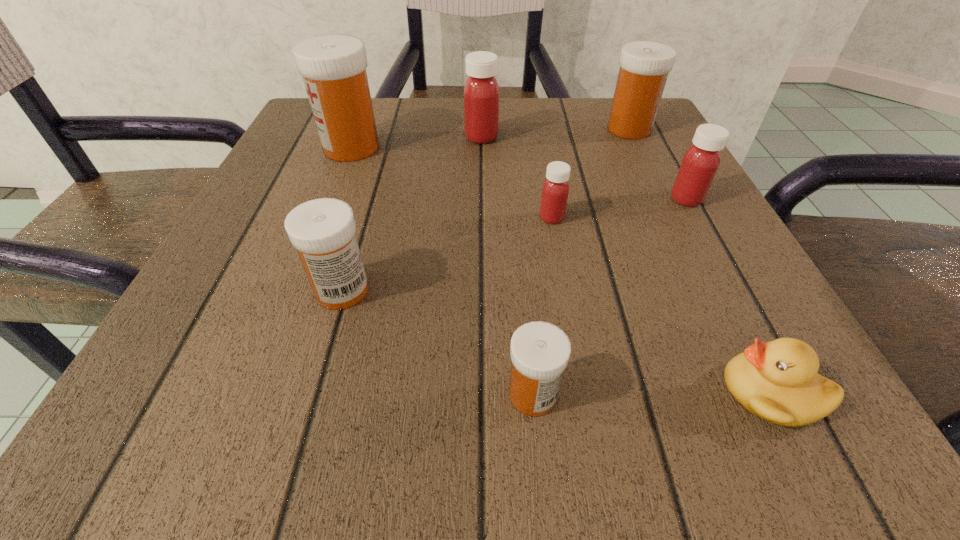
Find the location of a particular element. the tallest object is located at coordinates click(333, 67).

The width and height of the screenshot is (960, 540). What are the coordinates of `the tallest medicine` in the screenshot? It's located at (333, 67).

At what (x,y) coordinates should I click in order to perform the action: click on the second biggest white medicine. Please return your answer as a coordinate pair (x, y). Image resolution: width=960 pixels, height=540 pixels. Looking at the image, I should click on (644, 65).

The width and height of the screenshot is (960, 540). What are the coordinates of `the biggest red medicine` in the screenshot? It's located at (481, 91).

You are a GUI agent. You are given a task and a screenshot of the screen. Output one action in this format:
    pyautogui.click(x=<x>, y=<y>)
    Task: Click on the leftmost red medicine
    The height and width of the screenshot is (540, 960).
    Given the screenshot: What is the action you would take?
    pyautogui.click(x=481, y=91)

Where is `the fourth farthest medicine`? This screenshot has width=960, height=540. the fourth farthest medicine is located at coordinates (700, 163).

This screenshot has height=540, width=960. Identify the location of the fifth nearest object. (700, 163).

This screenshot has height=540, width=960. I want to click on the sixth farthest medicine, so click(x=323, y=231).

You are a GUI agent. You are given a task and a screenshot of the screen. Output one action in this format:
    pyautogui.click(x=<x>, y=<y>)
    Task: Click on the second smallest white medicine
    
    Given the screenshot: What is the action you would take?
    pyautogui.click(x=323, y=231)

You are a GUI agent. You are given a task and a screenshot of the screen. Output one action in this format:
    pyautogui.click(x=<x>, y=<y>)
    Task: Click on the third nearest medicine
    Image resolution: width=960 pixels, height=540 pixels.
    Given the screenshot: What is the action you would take?
    pyautogui.click(x=555, y=190)